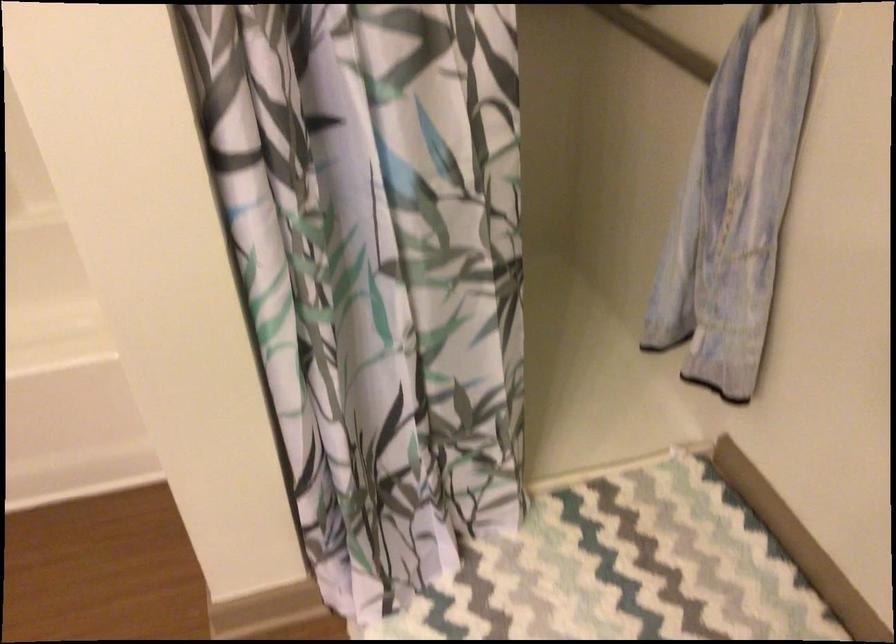
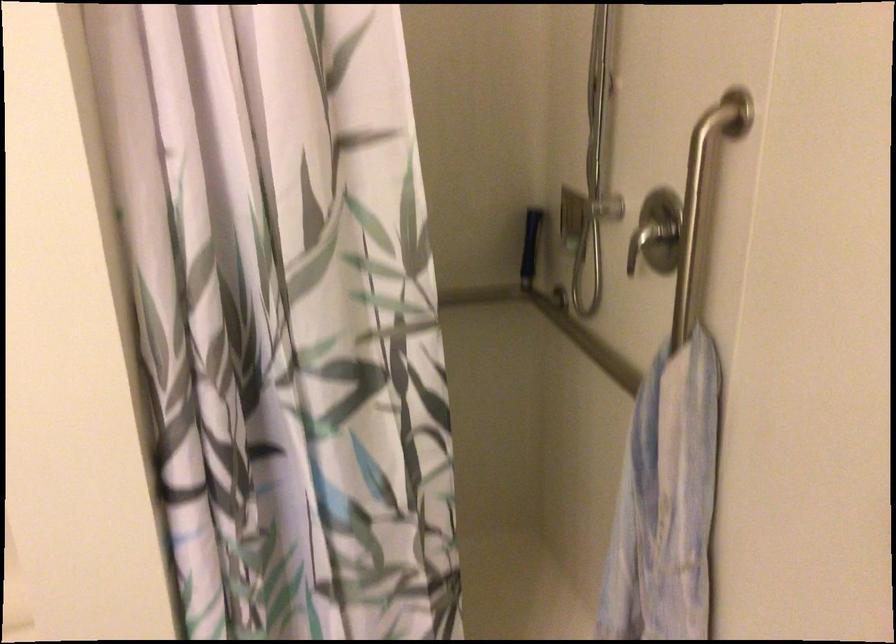
Question: The images are taken continuously from a first-person perspective. In which direction is your viewpoint rotating?

Choices:
 (A) Left
 (B) Right
 (C) Up
 (D) Down

Answer: (C)